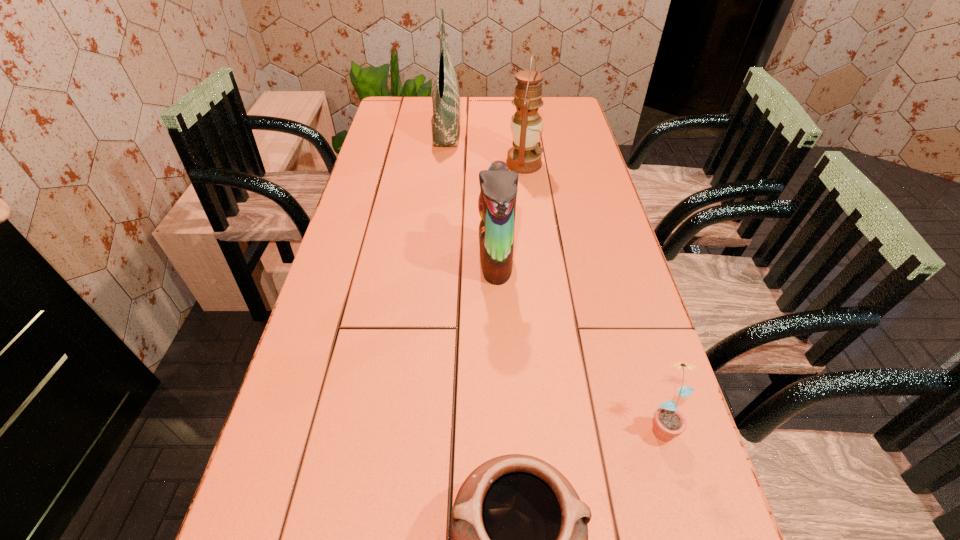
Identify which object is located as the third nearest to the tote bag. Please provide its 2D coordinates. Your answer should be formatted as a tuple, i.e. [(x, y)], where the tuple contains the x and y coordinates of a point satisfying the conditions above.

[(669, 422)]

Image resolution: width=960 pixels, height=540 pixels. I want to click on free region that satisfies the following two spatial constraints: 1. on the front side of the second tallest object; 2. on the right side of the tote bag, so click(443, 164).

Locate an element on the screen. Image resolution: width=960 pixels, height=540 pixels. blank space that satisfies the following two spatial constraints: 1. on the front side of the oil lamp; 2. on the right side of the leftmost object is located at coordinates (443, 164).